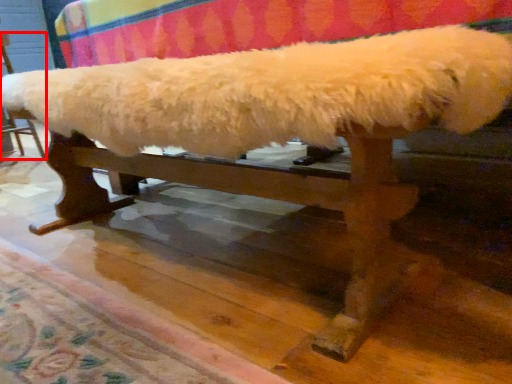
Question: From the image's perspective, where is furniture (annotated by the red box) located in relation to mat in the image?

Choices:
 (A) below
 (B) above

Answer: (B)